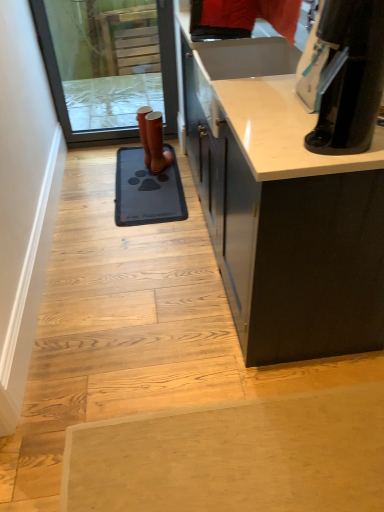
Question: From the image's perspective, is blue rubber doormat at center above or below white smooth door at left?

Choices:
 (A) above
 (B) below

Answer: (A)

Question: From a real-world perspective, is blue rubber doormat at center physically located above or below white smooth door at left?

Choices:
 (A) below
 (B) above

Answer: (A)

Question: Based on their relative distances, which object is nearer to the transparent glass screen door at upper left?

Choices:
 (A) blue rubber doormat at center
 (B) black glossy coffee maker at upper right
 (C) brown leather boot at center
 (D) white smooth door at left

Answer: (A)

Question: Which object is the closest to the black glossy coffee maker at upper right?

Choices:
 (A) white smooth door at left
 (B) blue rubber doormat at center
 (C) brown leather boot at center
 (D) transparent glass screen door at upper left

Answer: (A)